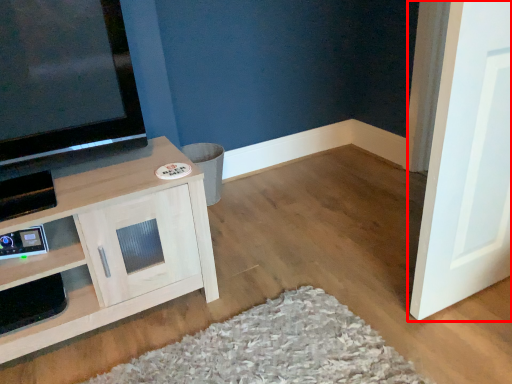
Question: From the image's perspective, where is door (annotated by the red box) located relative to cabinetry?

Choices:
 (A) below
 (B) above

Answer: (B)